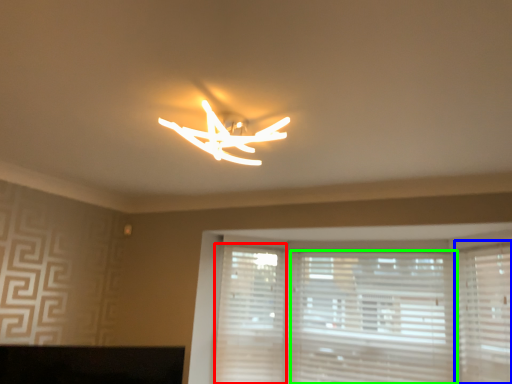
Question: Based on their relative distances, which object is nearer to shutter (highlighted by a red box)? Choose from shutter (highlighted by a blue box) and blind (highlighted by a green box).

Choices:
 (A) shutter
 (B) blind

Answer: (B)